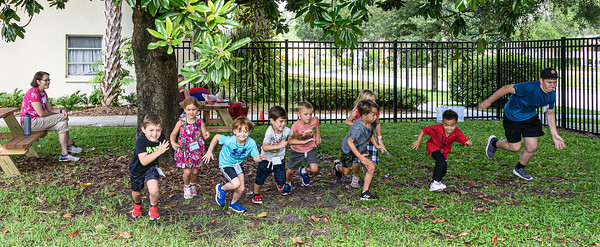
Identify the location of bench. The width and height of the screenshot is (600, 247). (20, 143).